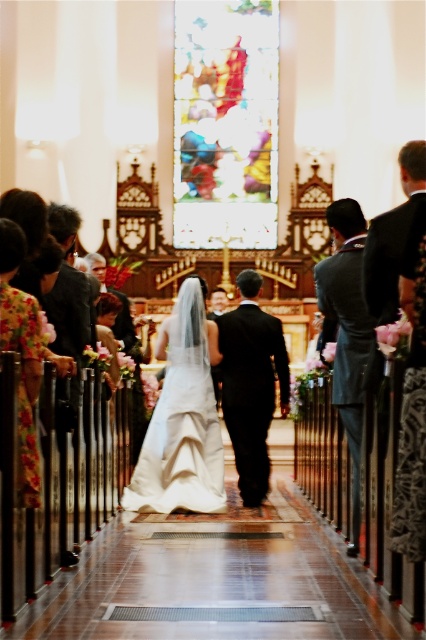
Question: Among these points, which one is nearest to the camera?

Choices:
 (A) (423, 422)
 (B) (281, 324)
 (C) (195, 579)

Answer: (A)

Question: Does black satin suit at right appear over black satin suit at center?

Choices:
 (A) no
 (B) yes

Answer: (B)

Question: Which of the following is the closest to the observer?

Choices:
 (A) (333, 394)
 (B) (210, 522)
 (C) (227, 419)

Answer: (A)

Question: Is black satin suit at center thinner than dark gray suit at center?

Choices:
 (A) yes
 (B) no

Answer: (B)

Question: Is wooden floor at center in front of black satin suit at center?

Choices:
 (A) no
 (B) yes

Answer: (B)

Question: Which point is farther to the camera?

Choices:
 (A) wooden floor at center
 (B) dark gray suit at center
 (C) black satin suit at center

Answer: (C)